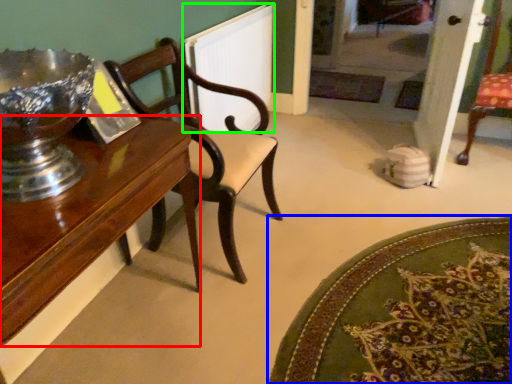
Question: Which is farther away from table (highlighted by a red box)? mat (highlighted by a blue box) or radiator (highlighted by a green box)?

Choices:
 (A) mat
 (B) radiator

Answer: (B)